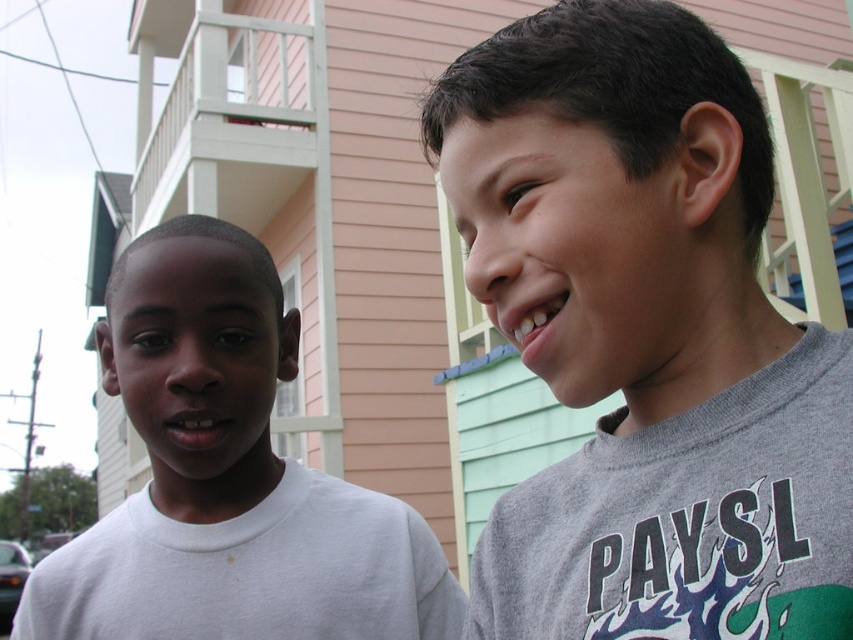
You are standing in front of the residential building and see two points marked on the ground. The first point is at point (664, 636) and the second is at point (254, 468). If you want to reach the point that is closer to the building, which one should you choose?

Point (254, 468) is closer to the building because it is behind point (664, 636), which is in front of it.